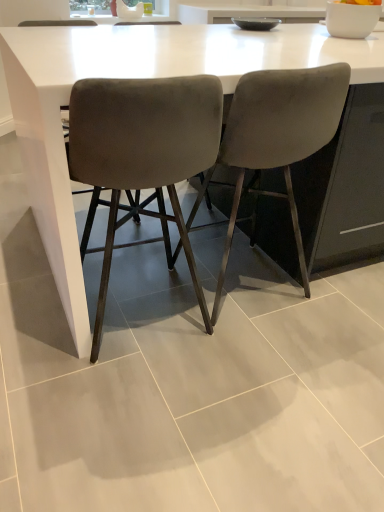
Question: Is velvet grey chair at center, which appears as the 1th chair when viewed from the left, behind white glossy table at center?

Choices:
 (A) no
 (B) yes

Answer: (A)

Question: From a real-world perspective, is velvet grey chair at center, the second chair in the right-to-left sequence, positioned under white glossy table at center based on gravity?

Choices:
 (A) no
 (B) yes

Answer: (A)

Question: Can you confirm if velvet grey chair at center, which appears as the 1th chair when viewed from the left, is positioned to the left of white glossy table at center?

Choices:
 (A) no
 (B) yes

Answer: (B)

Question: Is there a large distance between velvet grey chair at center, which appears as the 1th chair when viewed from the left, and white glossy table at center?

Choices:
 (A) no
 (B) yes

Answer: (A)

Question: From the image's perspective, is velvet grey chair at center, which appears as the 1th chair when viewed from the left, on white glossy table at center?

Choices:
 (A) yes
 (B) no

Answer: (B)

Question: Is velvet grey chair at center, placed as the first chair when sorted from right to left, spatially inside white glossy table at center, or outside of it?

Choices:
 (A) inside
 (B) outside

Answer: (A)

Question: In the image, is velvet grey chair at center, placed as the first chair when sorted from right to left, on the left side or the right side of white glossy table at center?

Choices:
 (A) left
 (B) right

Answer: (A)

Question: In the image, is velvet grey chair at center, the second chair when ordered from left to right, positioned in front of or behind white glossy table at center?

Choices:
 (A) behind
 (B) front

Answer: (A)

Question: Does point (304, 106) appear closer or farther from the camera than point (74, 51)?

Choices:
 (A) farther
 (B) closer

Answer: (B)

Question: Is velvet grey chair at center, the second chair in the right-to-left sequence, inside or outside of velvet grey chair at center, placed as the first chair when sorted from right to left?

Choices:
 (A) outside
 (B) inside

Answer: (A)

Question: From the image's perspective, is velvet grey chair at center, which appears as the 1th chair when viewed from the left, above or below velvet grey chair at center, placed as the first chair when sorted from right to left?

Choices:
 (A) below
 (B) above

Answer: (A)

Question: Considering their positions, is velvet grey chair at center, the second chair in the right-to-left sequence, located in front of or behind velvet grey chair at center, the second chair when ordered from left to right?

Choices:
 (A) behind
 (B) front

Answer: (B)

Question: Does point (137, 111) appear closer or farther from the camera than point (306, 274)?

Choices:
 (A) closer
 (B) farther

Answer: (A)

Question: In the image, is white glossy table at center on the left side or the right side of velvet grey chair at center, which appears as the 1th chair when viewed from the left?

Choices:
 (A) left
 (B) right

Answer: (B)

Question: Does point (33, 168) appear closer or farther from the camera than point (177, 113)?

Choices:
 (A) farther
 (B) closer

Answer: (A)